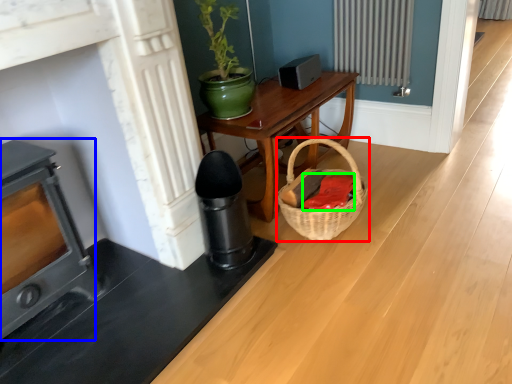
Question: Which is farther away from basket (highlighted by a red box)? heater (highlighted by a blue box) or material (highlighted by a green box)?

Choices:
 (A) heater
 (B) material

Answer: (A)